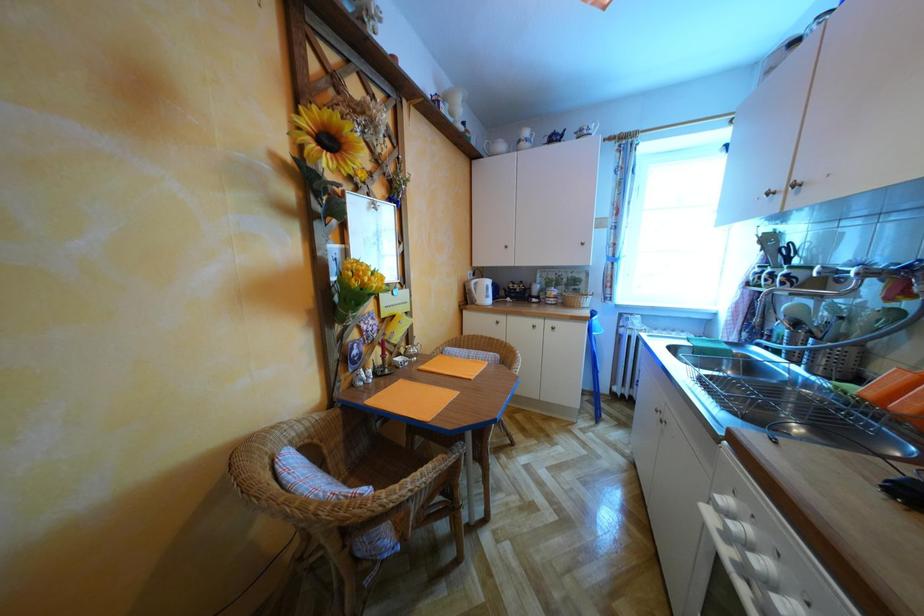
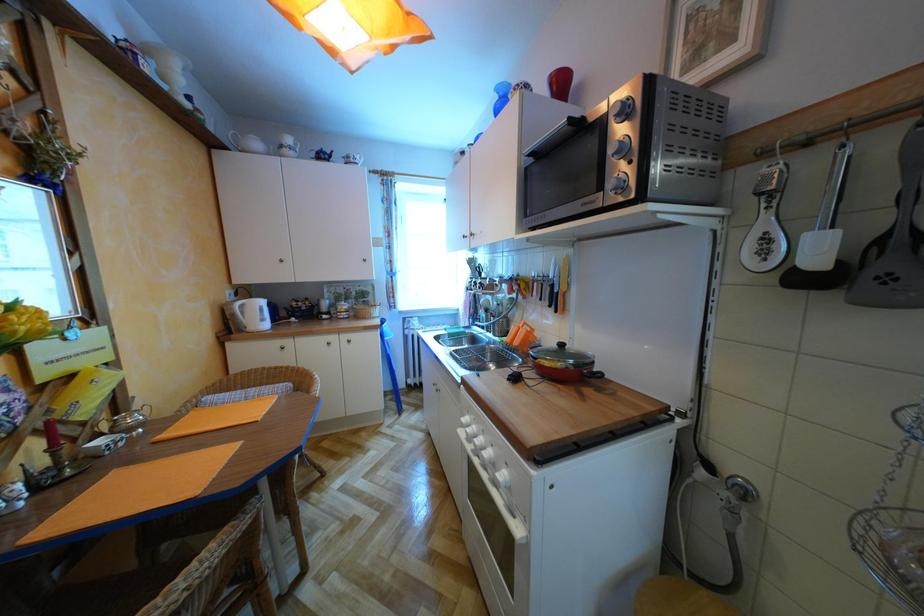
Question: The camera is either moving clockwise (left) or counter-clockwise (right) around the object. The first image is from the beginning of the video and the second image is from the end. Is the camera moving left or right when shooting the video?

Choices:
 (A) Left
 (B) Right

Answer: (A)